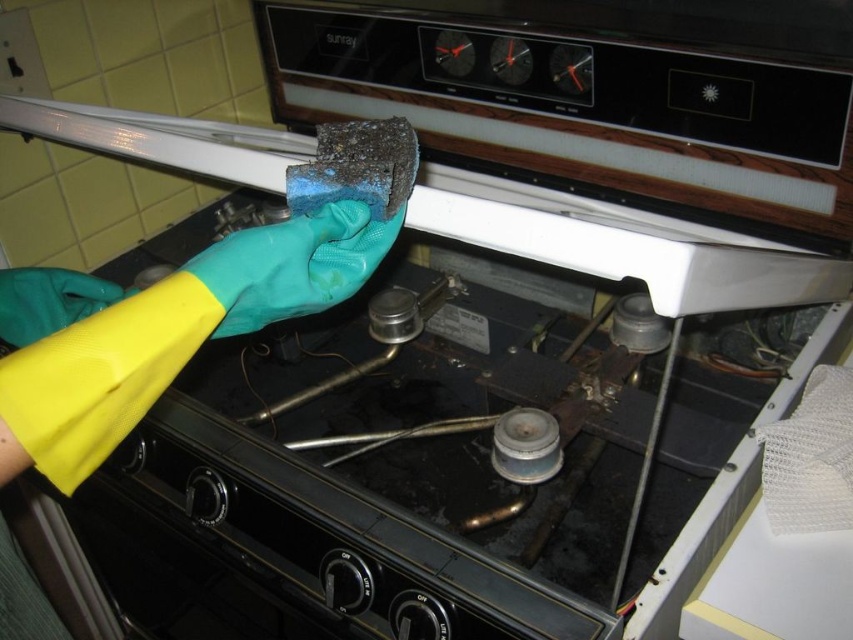
Can you confirm if yellow rubber glove at lower left is wider than blue rubber glove at center?

In fact, yellow rubber glove at lower left might be narrower than blue rubber glove at center.

Does point (93, 465) lie in front of point (259, 305)?

Yes, it is in front of point (259, 305).

Image resolution: width=853 pixels, height=640 pixels. What are the coordinates of `yellow rubber glove at lower left` in the screenshot? It's located at (102, 376).